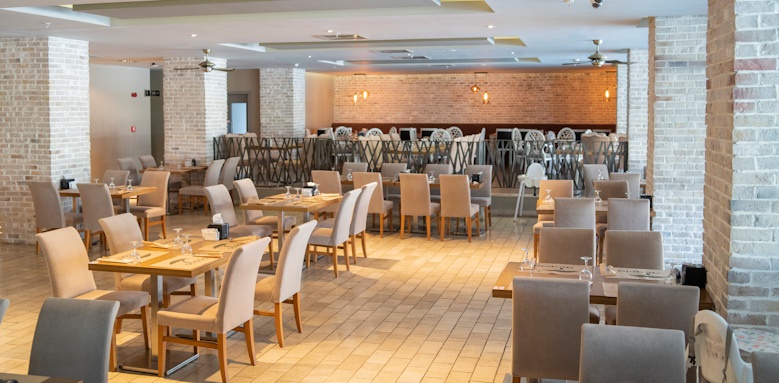
You are a GUI agent. You are given a task and a screenshot of the screen. Output one action in this format:
    pyautogui.click(x=<x>, y=<y>)
    Task: Click on the brick column
    
    Given the screenshot: What is the action you would take?
    pyautogui.click(x=30, y=91), pyautogui.click(x=202, y=98), pyautogui.click(x=291, y=101), pyautogui.click(x=643, y=96), pyautogui.click(x=693, y=106), pyautogui.click(x=741, y=132), pyautogui.click(x=619, y=109)